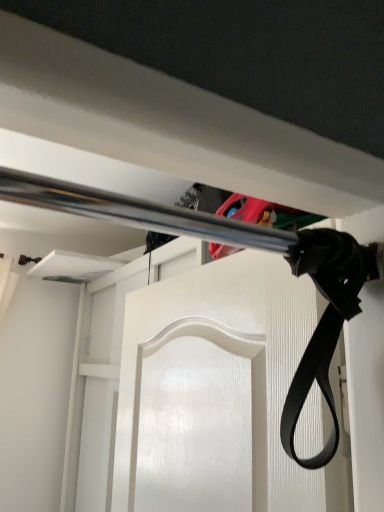
The height and width of the screenshot is (512, 384). Describe the element at coordinates (326, 320) in the screenshot. I see `black rubber leash at upper right` at that location.

The image size is (384, 512). I want to click on black rubber leash at upper right, so click(326, 320).

The width and height of the screenshot is (384, 512). What are the coordinates of `black rubber leash at upper right` in the screenshot? It's located at point(326,320).